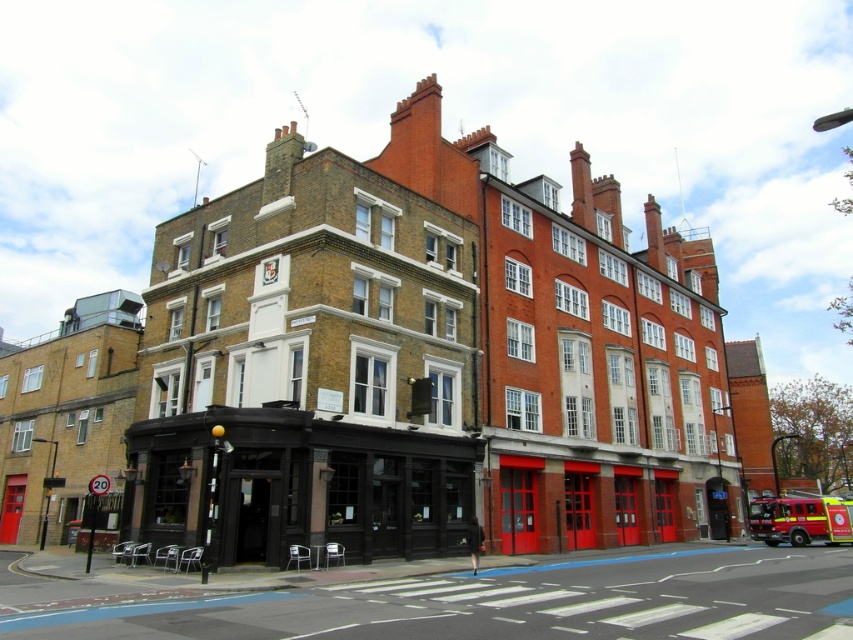
Is brick building at center bigger than smooth asphalt road at lower center?

Actually, brick building at center might be smaller than smooth asphalt road at lower center.

Is brick building at center to the right of smooth asphalt road at lower center from the viewer's perspective?

In fact, brick building at center is to the left of smooth asphalt road at lower center.

Locate an element on the screen. brick building at center is located at coordinates (306, 369).

This screenshot has height=640, width=853. Find the location of `brick building at center`. brick building at center is located at coordinates (306, 369).

Which is in front, point (833, 568) or point (759, 529)?

Point (833, 568) is in front.

Does smooth asphalt road at lower center appear on the right side of red matte fire truck at lower right?

Incorrect, smooth asphalt road at lower center is not on the right side of red matte fire truck at lower right.

Is point (473, 627) closer to viewer compared to point (798, 525)?

That is True.

Locate an element on the screen. smooth asphalt road at lower center is located at coordinates (511, 602).

Is point (22, 353) more distant than point (802, 525)?

Yes, it is.

Can you confirm if brick building at left is bigger than red matte fire truck at lower right?

Indeed, brick building at left has a larger size compared to red matte fire truck at lower right.

Looking at this image, who is more forward, (x=71, y=481) or (x=764, y=536)?

Point (x=71, y=481)

Find the location of a particular element. This screenshot has width=853, height=640. brick building at left is located at coordinates (64, 413).